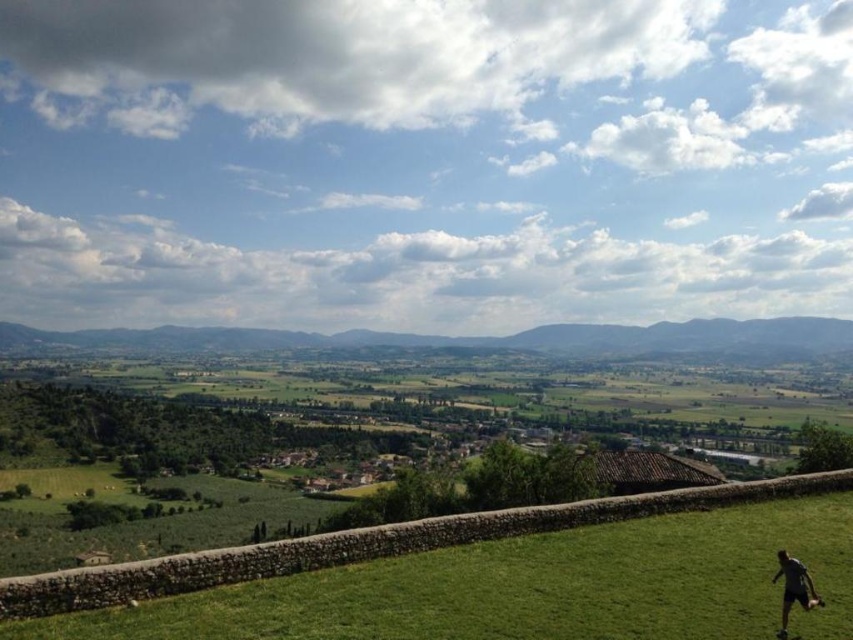
Question: Can you confirm if green grassy hillside at center is positioned to the left of dark gray shirt at lower right?

Choices:
 (A) yes
 (B) no

Answer: (A)

Question: Which of the following is the closest to the observer?

Choices:
 (A) dark gray shirt at lower right
 (B) green grassy hillside at center

Answer: (A)

Question: Does green grassy field at lower right have a lesser width compared to dark gray shirt at lower right?

Choices:
 (A) no
 (B) yes

Answer: (A)

Question: Which point appears closest to the camera in this image?

Choices:
 (A) (229, 588)
 (B) (782, 611)

Answer: (B)

Question: Can you confirm if green grassy hillside at center is positioned above dark gray shirt at lower right?

Choices:
 (A) yes
 (B) no

Answer: (B)

Question: Considering the real-world distances, which object is farthest from the green grassy field at lower right?

Choices:
 (A) green grassy hillside at center
 (B) dark gray shirt at lower right

Answer: (A)